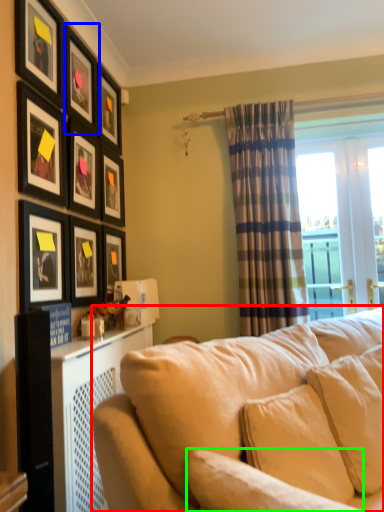
Question: Considering the real-world distances, which object is farthest from studio couch (highlighted by a red box)? picture frame (highlighted by a blue box) or pillow (highlighted by a green box)?

Choices:
 (A) picture frame
 (B) pillow

Answer: (A)